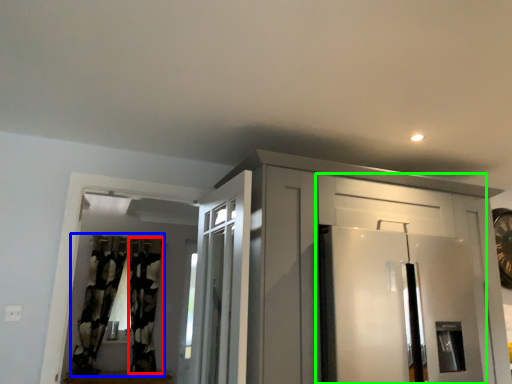
Question: Based on their relative distances, which object is farther from curtain (highlighted by a red box)? Choose from curtain (highlighted by a blue box) and door (highlighted by a green box).

Choices:
 (A) curtain
 (B) door

Answer: (B)